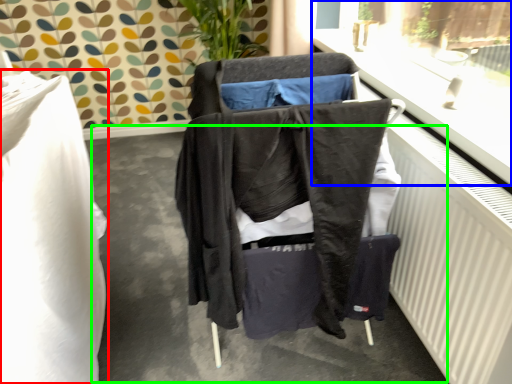
Question: Considering the real-world distances, which object is closest to furniture (highlighted by a red box)? window frame (highlighted by a blue box) or concrete (highlighted by a green box).

Choices:
 (A) window frame
 (B) concrete

Answer: (B)